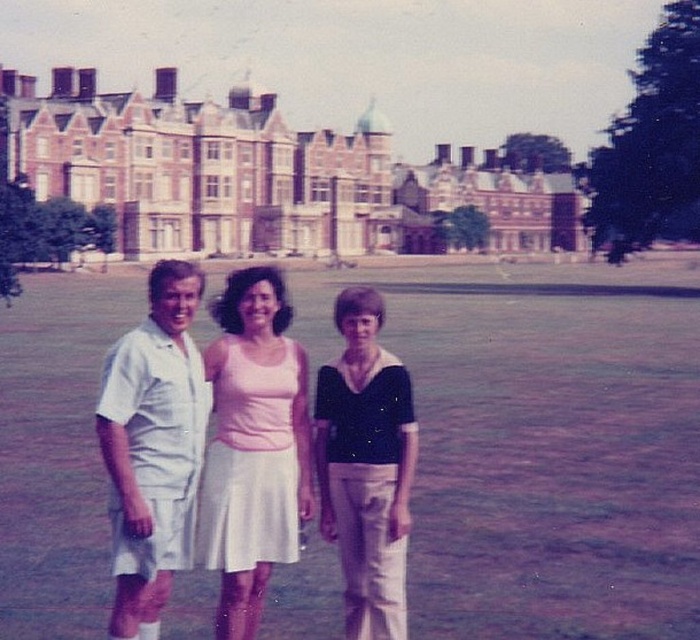
In the scene shown: Does pink fabric dress at center appear under white cotton shorts at left?

Actually, pink fabric dress at center is above white cotton shorts at left.

Which of these two, pink fabric dress at center or white cotton shorts at left, stands taller?

pink fabric dress at center is taller.

Between point (248, 292) and point (118, 381), which one is positioned in front?

Point (118, 381)

The image size is (700, 640). In order to click on pink fabric dress at center in this screenshot , I will do `click(253, 445)`.

What do you see at coordinates (266, 176) in the screenshot?
I see `brown brick building at upper center` at bounding box center [266, 176].

Is point (360, 145) positioned before point (384, 570)?

That is False.

Between point (448, 164) and point (379, 452), which one is positioned in front?

Point (379, 452) is in front.

This screenshot has height=640, width=700. Find the location of `brown brick building at upper center`. brown brick building at upper center is located at coordinates (266, 176).

Does green grass at center appear on the right side of pink fabric dress at center?

Yes, green grass at center is to the right of pink fabric dress at center.

Does green grass at center have a greater height compared to pink fabric dress at center?

Incorrect, green grass at center's height is not larger of pink fabric dress at center's.

Who is more distant from viewer, (694, 513) or (300, 416)?

The point (694, 513) is behind.

Identify the location of green grass at center. The width and height of the screenshot is (700, 640). (542, 442).